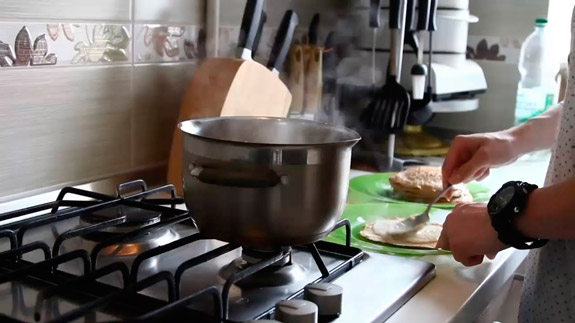
The image size is (575, 323). Find the location of `plates`. plates is located at coordinates (373, 204), (373, 184).